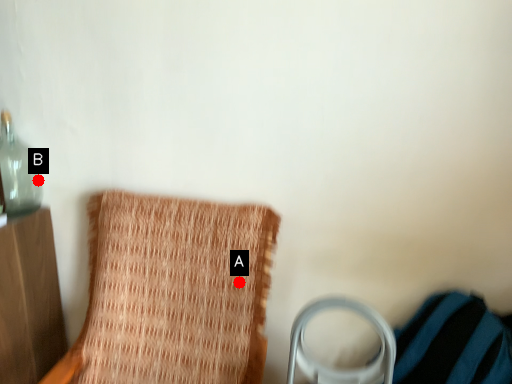
Question: Two points are circled on the image, labeled by A and B beside each circle. Which point appears farthest from the camera in this image?

Choices:
 (A) A is further
 (B) B is further

Answer: (B)